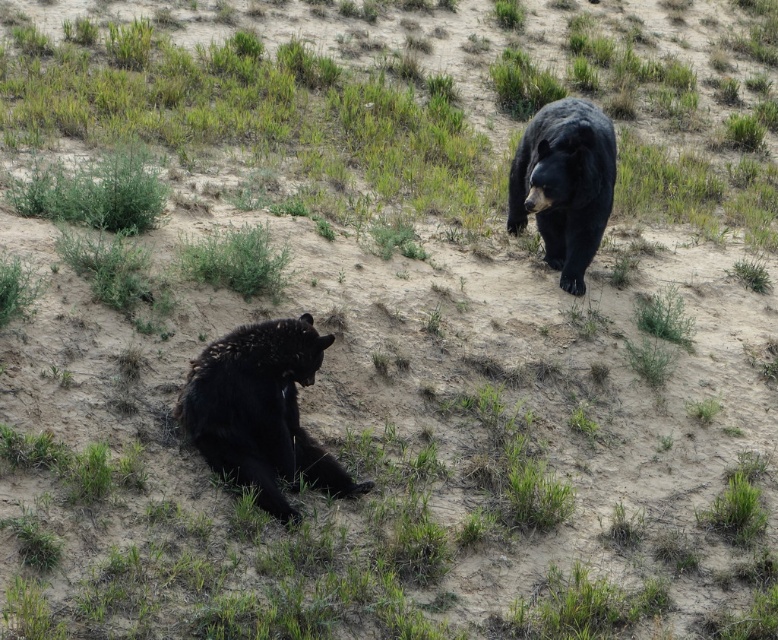
You are a wildlife photographer aiming to capture a photo of both bears without moving your camera position. Since you want to ensure both bears are in the frame, can you confirm if the shiny black bear at lower left and the shiny black bear at upper right are positioned side by side horizontally?

The shiny black bear at lower left is positioned on the left side of the shiny black bear at upper right, so they are positioned side by side horizontally and can be captured in the same frame.

You are a wildlife photographer aiming to capture both bears in a single frame. Given their positions and sizes, which bear, the shiny black bear at lower left or the shiny black bear at upper right, would appear larger in your photo?

The shiny black bear at upper right would appear larger in the photo because it is taller than the shiny black bear at lower left.

You are a wildlife photographer positioned at the center of the scene. You want to take a photo of both bears without moving your camera. Which bear, the shiny black bear at lower left or the shiny black bear at upper right, will appear larger in your photo?

The shiny black bear at lower left will appear larger in the photo because it is closer to the viewer than the shiny black bear at upper right.